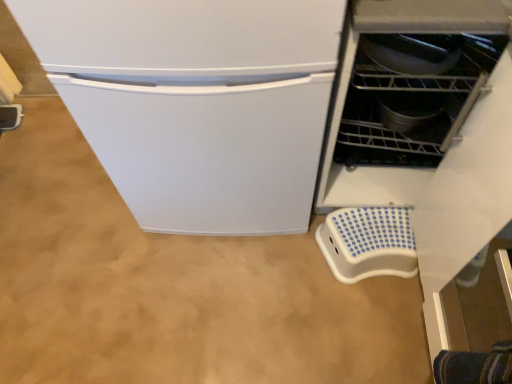
Question: Is blue dotted plastic step stool at lower right at the left side of metallic gray dishwasher at right?

Choices:
 (A) no
 (B) yes

Answer: (A)

Question: Does blue dotted plastic step stool at lower right have a lesser height compared to metallic gray dishwasher at right?

Choices:
 (A) no
 (B) yes

Answer: (B)

Question: Is blue dotted plastic step stool at lower right in front of metallic gray dishwasher at right?

Choices:
 (A) no
 (B) yes

Answer: (A)

Question: Is metallic gray dishwasher at right inside blue dotted plastic step stool at lower right?

Choices:
 (A) no
 (B) yes

Answer: (A)

Question: Is blue dotted plastic step stool at lower right turned away from metallic gray dishwasher at right?

Choices:
 (A) no
 (B) yes

Answer: (A)

Question: From a real-world perspective, is blue dotted plastic step stool at lower right on metallic gray dishwasher at right?

Choices:
 (A) yes
 (B) no

Answer: (B)

Question: Can blue dotted plastic step stool at lower right be found inside metallic gray dishwasher at right?

Choices:
 (A) yes
 (B) no

Answer: (B)

Question: Does metallic gray dishwasher at right turn towards blue dotted plastic step stool at lower right?

Choices:
 (A) no
 (B) yes

Answer: (B)

Question: Does metallic gray dishwasher at right lie in front of blue dotted plastic step stool at lower right?

Choices:
 (A) no
 (B) yes

Answer: (B)

Question: Does metallic gray dishwasher at right appear on the left side of blue dotted plastic step stool at lower right?

Choices:
 (A) yes
 (B) no

Answer: (A)

Question: Is metallic gray dishwasher at right located outside blue dotted plastic step stool at lower right?

Choices:
 (A) no
 (B) yes

Answer: (B)

Question: Is metallic gray dishwasher at right wider than blue dotted plastic step stool at lower right?

Choices:
 (A) yes
 (B) no

Answer: (A)

Question: Considering the positions of blue dotted plastic step stool at lower right and metallic gray dishwasher at right in the image, is blue dotted plastic step stool at lower right wider or thinner than metallic gray dishwasher at right?

Choices:
 (A) wide
 (B) thin

Answer: (B)